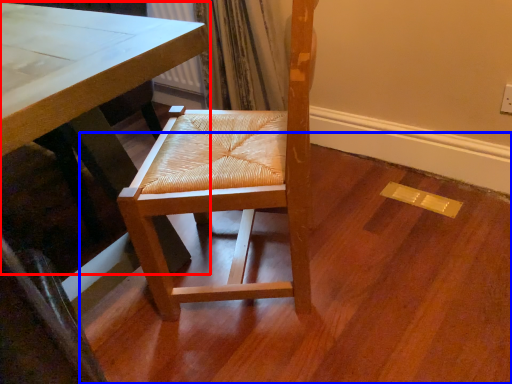
Question: Among these objects, which one is nearest to the camera, table (highlighted by a red box) or plywood (highlighted by a blue box)?

Choices:
 (A) table
 (B) plywood

Answer: (A)